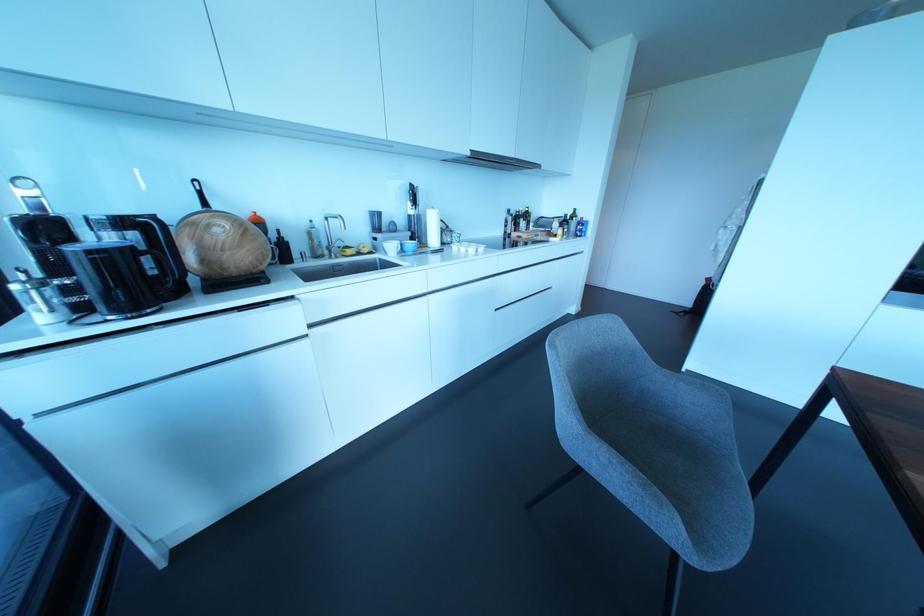
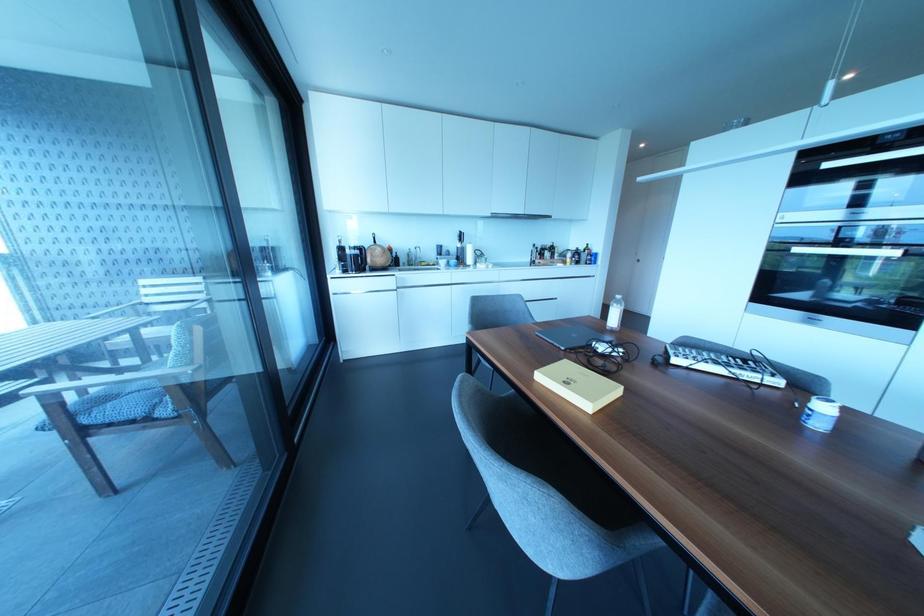
Based on the photo, which direction would the cameraman need to move to produce the second image?

The cameraman moved toward right, backward.